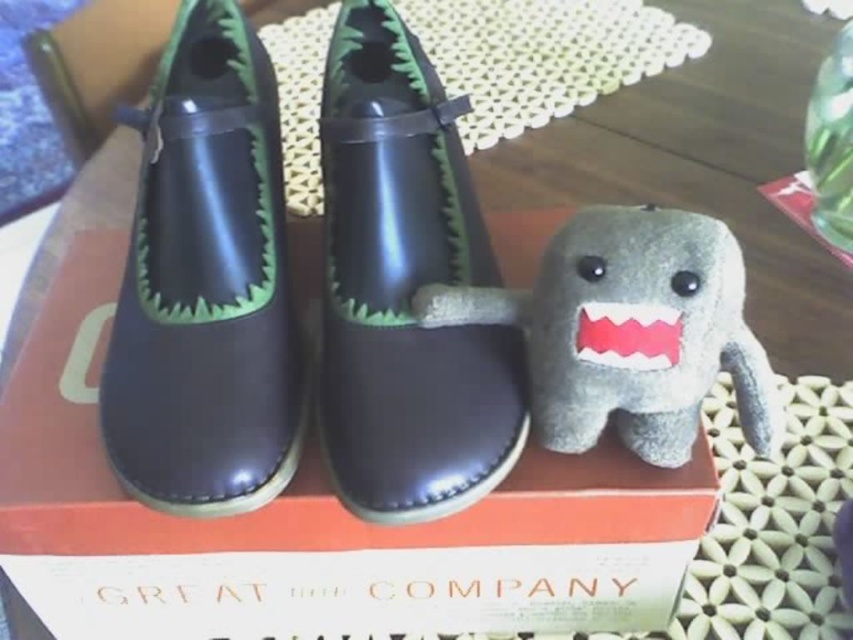
Question: Which point is closer to the camera taking this photo?

Choices:
 (A) (244, 49)
 (B) (608, 342)

Answer: (B)

Question: Among these objects, which one is farthest from the camera?

Choices:
 (A) gray plush toy at center
 (B) shiny black shoe at center

Answer: (B)

Question: Does shiny black shoe at left appear under gray plush toy at center?

Choices:
 (A) yes
 (B) no

Answer: (B)

Question: Which of the following is the closest to the observer?

Choices:
 (A) (693, 301)
 (B) (335, 337)

Answer: (A)

Question: Is shiny black shoe at left to the right of shiny black shoe at center from the viewer's perspective?

Choices:
 (A) no
 (B) yes

Answer: (A)

Question: Can you confirm if shiny black shoe at center is positioned to the right of gray plush toy at center?

Choices:
 (A) no
 (B) yes

Answer: (A)